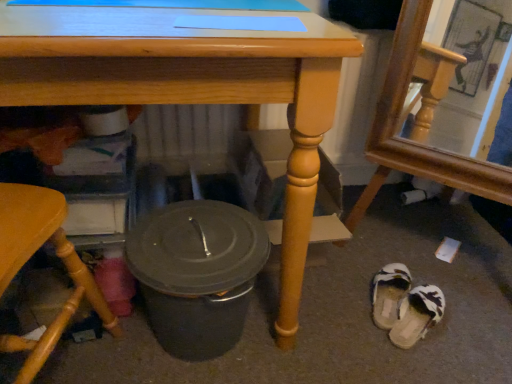
Question: From the image's perspective, is matte gray crock pot at lower center located above matte wood table at center?

Choices:
 (A) yes
 (B) no

Answer: (B)

Question: Is matte gray crock pot at lower center bigger than matte wood table at center?

Choices:
 (A) no
 (B) yes

Answer: (A)

Question: Is matte gray crock pot at lower center facing away from matte wood table at center?

Choices:
 (A) no
 (B) yes

Answer: (B)

Question: From the image's perspective, is matte gray crock pot at lower center below matte wood table at center?

Choices:
 (A) no
 (B) yes

Answer: (B)

Question: Does matte gray crock pot at lower center appear on the right side of matte wood table at center?

Choices:
 (A) no
 (B) yes

Answer: (B)

Question: Is matte gray crock pot at lower center thinner than matte wood table at center?

Choices:
 (A) yes
 (B) no

Answer: (A)

Question: Is wooden chair at lower left, the 1th chair when ordered from left to right, aimed at white fabric slipper at lower right, which is the first footwear in top-to-bottom order?

Choices:
 (A) yes
 (B) no

Answer: (B)

Question: Is wooden chair at lower left, acting as the 2th chair starting from the right, not near white fabric slipper at lower right, which is the first footwear in top-to-bottom order?

Choices:
 (A) no
 (B) yes

Answer: (A)

Question: From the image's perspective, is wooden chair at lower left, acting as the 2th chair starting from the right, under white fabric slipper at lower right, which is counted as the second footwear, starting from the bottom?

Choices:
 (A) yes
 (B) no

Answer: (B)

Question: From a real-world perspective, is wooden chair at lower left, the 1th chair when ordered from left to right, physically above white fabric slipper at lower right, which is counted as the second footwear, starting from the bottom?

Choices:
 (A) no
 (B) yes

Answer: (B)

Question: From a real-world perspective, does wooden chair at lower left, the 1th chair when ordered from left to right, sit lower than white fabric slipper at lower right, which is counted as the second footwear, starting from the bottom?

Choices:
 (A) yes
 (B) no

Answer: (B)

Question: Is wooden chair at lower left, acting as the 2th chair starting from the right, next to white fabric slipper at lower right, which is the first footwear in top-to-bottom order, and touching it?

Choices:
 (A) yes
 (B) no

Answer: (B)

Question: Is matte wood table at center not within wooden frame mirror at lower right, positioned as the 2th chair in left-to-right order?

Choices:
 (A) no
 (B) yes

Answer: (B)